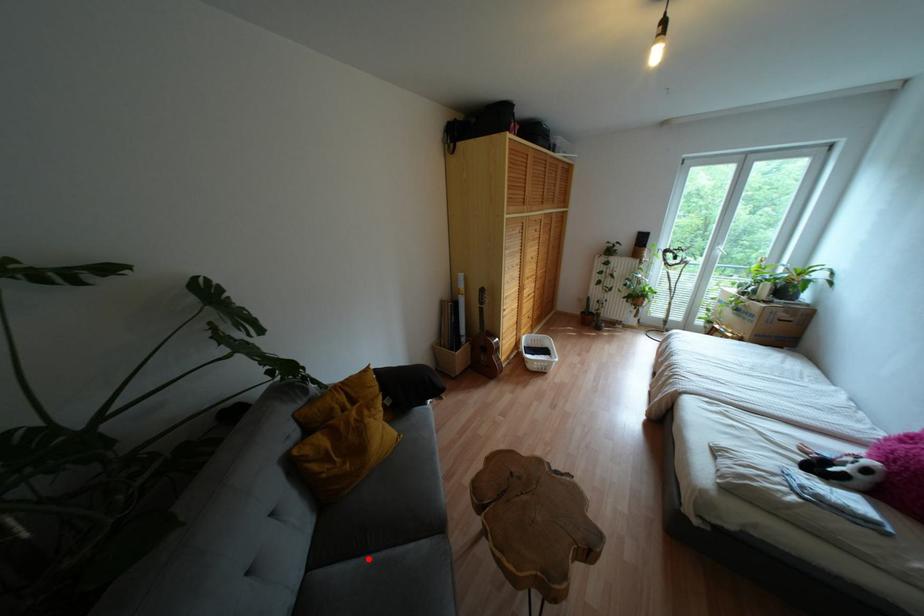
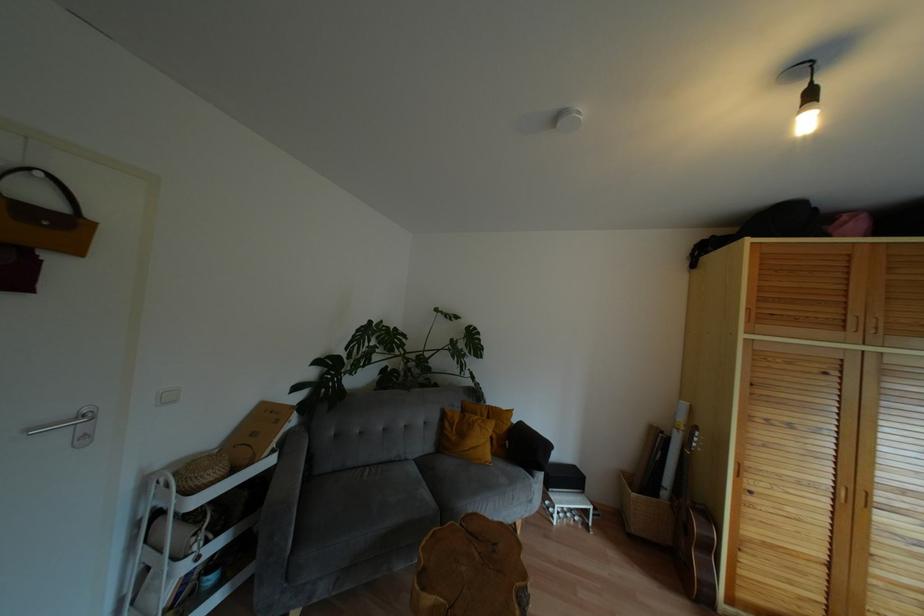
Question: I am providing you with two images of the same scene from different viewpoints. Given a red point in image1, look at the same physical point in image2. Is it:

Choices:
 (A) Closer to the viewpoint
 (B) Farther from the viewpoint

Answer: (B)